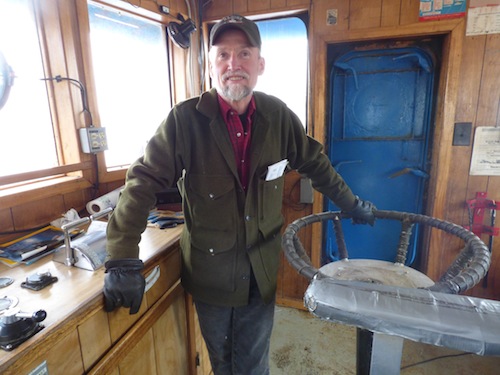
The width and height of the screenshot is (500, 375). In order to click on window in this screenshot , I will do `click(114, 70)`.